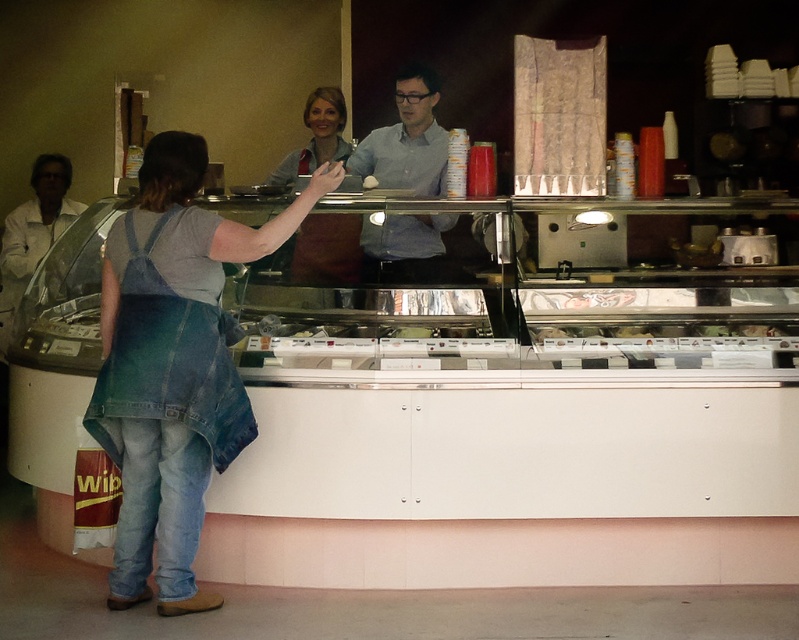
You are a customer at the ice cream shop and need to reach the counter to order. There is a path between the denim overalls at left and the white matte jacket at left. Can you walk through this path if you need 2 meters of space to move comfortably?

The path between the denim overalls at left and the white matte jacket at left is 2.38 meters wide, so yes, you can walk through the path since it provides enough space for your 2 meters requirement.

You are a customer in the ice cream shop. You want to take a photo of the point at coordinate point (292,275). The camera you have can only focus on objects within 15 feet. Will the camera be able to focus on the point?

The point at coordinate point (292,275) is 15.55 feet away from the camera, which is beyond the camera focus range of 15 feet. Therefore, the camera will not be able to focus on the point.

You are a customer in the ice cream shop and want to ask the staff member in the white matte jacket at left for a recommendation. Since you can only see the back of the person in the matte blue apron at center, which staff member should you approach?

You should approach the white matte jacket at left because the matte blue apron at center is to the right of it, meaning the white matte jacket at left is facing towards you and available for assistance.